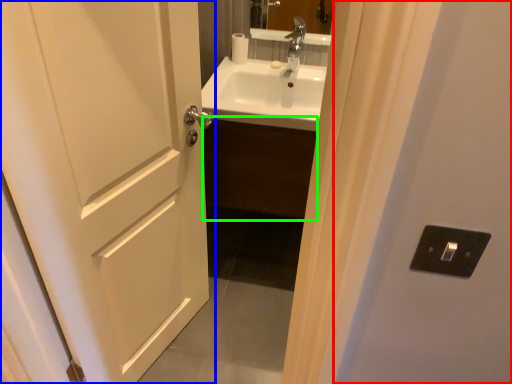
Question: Which object is positioned farthest from screen door (highlighted by a red box)? Select from door (highlighted by a blue box) and cabinetry (highlighted by a green box).

Choices:
 (A) door
 (B) cabinetry

Answer: (B)